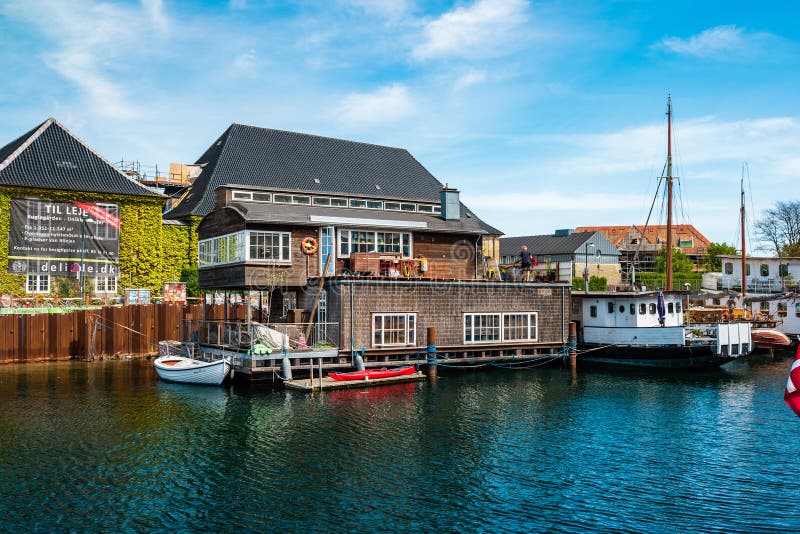
In order to click on chimney in this screenshot , I will do `click(453, 202)`.